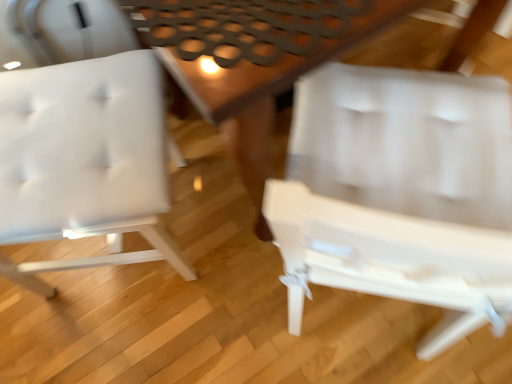
Question: Is wooden table at center not close to white plastic chair at center, arranged as the first chair when viewed from the right?

Choices:
 (A) no
 (B) yes

Answer: (A)

Question: Does wooden table at center have a smaller size compared to white plastic chair at center, arranged as the first chair when viewed from the right?

Choices:
 (A) yes
 (B) no

Answer: (B)

Question: Does wooden table at center appear on the left side of white plastic chair at center, placed as the second chair when sorted from left to right?

Choices:
 (A) yes
 (B) no

Answer: (A)

Question: Is white plastic chair at center, arranged as the first chair when viewed from the right, surrounded by wooden table at center?

Choices:
 (A) no
 (B) yes

Answer: (A)

Question: Is wooden table at center thinner than white plastic chair at center, arranged as the first chair when viewed from the right?

Choices:
 (A) yes
 (B) no

Answer: (B)

Question: Is white matte chair at left, positioned as the first chair in left-to-right order, taller or shorter than wooden table at center?

Choices:
 (A) short
 (B) tall

Answer: (B)

Question: From the image's perspective, is white matte chair at left, which appears as the 2th chair when viewed from the right, located above or below wooden table at center?

Choices:
 (A) above
 (B) below

Answer: (B)

Question: Does point (79, 228) appear closer or farther from the camera than point (199, 66)?

Choices:
 (A) closer
 (B) farther

Answer: (B)

Question: From a real-world perspective, relative to wooden table at center, is white matte chair at left, which appears as the 2th chair when viewed from the right, vertically above or below?

Choices:
 (A) above
 (B) below

Answer: (A)

Question: From a real-world perspective, is white matte chair at left, positioned as the first chair in left-to-right order, positioned above or below white plastic chair at center, arranged as the first chair when viewed from the right?

Choices:
 (A) above
 (B) below

Answer: (B)

Question: Would you say white matte chair at left, which appears as the 2th chair when viewed from the right, is to the left or to the right of white plastic chair at center, placed as the second chair when sorted from left to right, in the picture?

Choices:
 (A) right
 (B) left

Answer: (B)

Question: Would you say white matte chair at left, positioned as the first chair in left-to-right order, is inside or outside white plastic chair at center, arranged as the first chair when viewed from the right?

Choices:
 (A) outside
 (B) inside

Answer: (A)

Question: From their relative heights in the image, would you say white matte chair at left, positioned as the first chair in left-to-right order, is taller or shorter than white plastic chair at center, placed as the second chair when sorted from left to right?

Choices:
 (A) tall
 (B) short

Answer: (B)

Question: Is wooden table at center to the left or to the right of white plastic chair at center, arranged as the first chair when viewed from the right, in the image?

Choices:
 (A) right
 (B) left

Answer: (B)

Question: From the image's perspective, relative to white plastic chair at center, arranged as the first chair when viewed from the right, is wooden table at center above or below?

Choices:
 (A) above
 (B) below

Answer: (A)